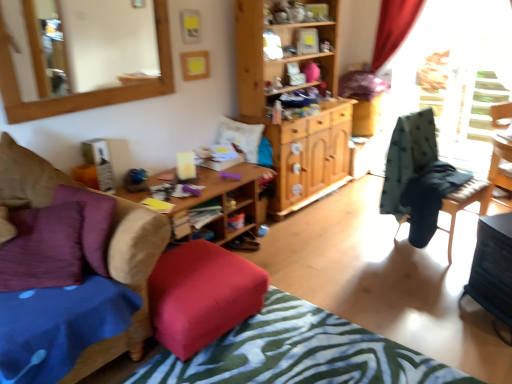
Describe the element at coordinates (493, 269) in the screenshot. I see `black glossy table at lower right` at that location.

In order to face wooden chair at right, the second chair when ordered from front to back, should I rotate leftwards or rightwards?

It's best to rotate right around 23.184 degrees.

The height and width of the screenshot is (384, 512). Describe the element at coordinates (128, 282) in the screenshot. I see `velvet cushion at lower left, the second chair when ordered from right to left` at that location.

Image resolution: width=512 pixels, height=384 pixels. Find the location of `velvet cushion at lower left, which is counted as the second chair, starting from the back`. velvet cushion at lower left, which is counted as the second chair, starting from the back is located at coordinates (128, 282).

The height and width of the screenshot is (384, 512). Describe the element at coordinates (298, 353) in the screenshot. I see `textured green and white bedspread at lower center` at that location.

The width and height of the screenshot is (512, 384). Describe the element at coordinates (241, 137) in the screenshot. I see `white soft pillow at center, placed as the 1th pillow when sorted from back to front` at that location.

Find the location of `wooden-framed mirror at upper left`. wooden-framed mirror at upper left is located at coordinates (83, 93).

Which of these two, velvet cushion at lower left, the second chair when ordered from right to left, or textured green and white bedspread at lower center, is thinner?

velvet cushion at lower left, the second chair when ordered from right to left, is thinner.

Is point (109, 250) farther from viewer compared to point (277, 323)?

No.

Is velvet cushion at lower left, which is the 1th chair from left to right, facing towards textured green and white bedspread at lower center?

Result: Yes, velvet cushion at lower left, which is the 1th chair from left to right, is oriented towards textured green and white bedspread at lower center.

There is a textured green and white bedspread at lower center. Where is `the 1st chair above it (from a real-world perspective)`? the 1st chair above it (from a real-world perspective) is located at coordinates (128, 282).

From a real-world perspective, is wooden cabinet at center physically located above or below white soft pillow at center, placed as the 1th pillow when sorted from back to front?

wooden cabinet at center is situated higher than white soft pillow at center, placed as the 1th pillow when sorted from back to front, in the real world.

Are wooden cabinet at center and white soft pillow at center, the 1th pillow from the right, beside each other?

No, wooden cabinet at center is not in contact with white soft pillow at center, the 1th pillow from the right.

In order to click on cabinetry in front of the white soft pillow at center, placed as the 1th pillow when sorted from back to front in this screenshot , I will do `click(291, 120)`.

Who is bigger, velvet red stool at center or black glossy table at lower right?

Bigger between the two is velvet red stool at center.

Is velvet red stool at center completely or partially outside of black glossy table at lower right?

That's correct, velvet red stool at center is outside of black glossy table at lower right.

Does green fabric chair at right turn towards black glossy table at lower right?

Yes, green fabric chair at right is facing black glossy table at lower right.

From the image's perspective, between green fabric chair at right and black glossy table at lower right, which one is located above?

green fabric chair at right is shown above in the image.

Is green fabric chair at right far away from black glossy table at lower right?

Yes, green fabric chair at right and black glossy table at lower right are quite far apart.

From a real-world perspective, is velvet red stool at center on green fabric chair at right?

No, from a real-world perspective, velvet red stool at center is not above green fabric chair at right.

Is velvet red stool at center positioned far away from green fabric chair at right?

Yes, velvet red stool at center and green fabric chair at right are quite far apart.

Between velvet red stool at center and green fabric chair at right, which one has smaller size?

velvet red stool at center is smaller.

Considering the positions of objects velvet red stool at center and green fabric chair at right in the image provided, who is in front, velvet red stool at center or green fabric chair at right?

Positioned in front is velvet red stool at center.

Is the surface of velvet red stool at center in direct contact with textured green and white bedspread at lower center?

No, velvet red stool at center is not next to textured green and white bedspread at lower center.

From the image's perspective, does velvet red stool at center appear higher than textured green and white bedspread at lower center?

Correct, velvet red stool at center appears higher than textured green and white bedspread at lower center in the image.

What's the angular difference between velvet red stool at center and textured green and white bedspread at lower center's facing directions?

The angular difference between velvet red stool at center and textured green and white bedspread at lower center is 3.98 degrees.

Which is more to the left, velvet red stool at center or textured green and white bedspread at lower center?

Positioned to the left is velvet red stool at center.

From the image's perspective, is green fabric chair at right above wooden desk at center?

Correct, green fabric chair at right appears higher than wooden desk at center in the image.

Looking at their sizes, would you say green fabric chair at right is wider or thinner than wooden desk at center?

green fabric chair at right is thinner than wooden desk at center.

Is green fabric chair at right placed right next to wooden desk at center?

No, green fabric chair at right is not next to wooden desk at center.

Would you say green fabric chair at right is outside wooden desk at center?

green fabric chair at right is positioned outside wooden desk at center.

Find the location of a particular element. chair that is the 1st object located behind the textured green and white bedspread at lower center is located at coordinates (128, 282).

Locate an element on the screen. This screenshot has height=384, width=512. cabinetry above the white soft pillow at center, the second pillow in the left-to-right sequence (from a real-world perspective) is located at coordinates (291, 120).

Considering their positions, is white soft pillow at center, the 1th pillow from the right, positioned further to textured green and white bedspread at lower center than purple velvet pillow at left, positioned as the 2th pillow in back-to-front order?

white soft pillow at center, the 1th pillow from the right, lies further to textured green and white bedspread at lower center than the other object.

Which object lies further to the anchor point wooden-framed mirror at upper left, velvet red stool at center or purple velvet pillow at left, which is the first pillow from left to right?

Based on the image, velvet red stool at center appears to be further to wooden-framed mirror at upper left.

Considering their positions, is textured green and white bedspread at lower center positioned closer to wooden desk at center than white soft pillow at center, the 1th pillow from the right?

Based on the image, white soft pillow at center, the 1th pillow from the right, appears to be nearer to wooden desk at center.

When comparing their distances from wooden cabinet at center, does black glossy table at lower right or textured green and white bedspread at lower center seem further?

Among the two, black glossy table at lower right is located further to wooden cabinet at center.

Estimate the real-world distances between objects in this image. Which object is further from white soft pillow at center, the 1th pillow from the right, wooden-framed mirror at upper left or wooden chair at right, placed as the 1th chair when sorted from right to left?

wooden chair at right, placed as the 1th chair when sorted from right to left, is further to white soft pillow at center, the 1th pillow from the right.

From the image, which object appears to be farther from wooden chair at right, acting as the 2th chair starting from the left, wooden-framed mirror at upper left or white soft pillow at center, the second pillow in the left-to-right sequence?

Among the two, wooden-framed mirror at upper left is located further to wooden chair at right, acting as the 2th chair starting from the left.

From the picture: Looking at the image, which one is located further to purple velvet pillow at left, which is the second pillow in right-to-left order, velvet cushion at lower left, the second chair when ordered from right to left, or wooden-framed mirror at upper left?

Based on the image, velvet cushion at lower left, the second chair when ordered from right to left, appears to be further to purple velvet pillow at left, which is the second pillow in right-to-left order.

Which object lies nearer to the anchor point wooden cabinet at center, wooden desk at center or wooden-framed mirror at upper left?

The object closer to wooden cabinet at center is wooden desk at center.

I want to click on cabinetry between wooden-framed mirror at upper left and velvet red stool at center in the up-down direction, so click(x=291, y=120).

Identify the location of mirror between purple velvet pillow at left, which is the first pillow from left to right, and white soft pillow at center, placed as the 1th pillow when sorted from back to front, in the front-back direction. (83, 93).

You are a GUI agent. You are given a task and a screenshot of the screen. Output one action in this format:
    pyautogui.click(x=<x>, y=<y>)
    Task: Click on the stool between wooden-framed mirror at upper left and green fabric chair at right from left to right
    Image resolution: width=512 pixels, height=384 pixels.
    Given the screenshot: What is the action you would take?
    pyautogui.click(x=202, y=295)

The image size is (512, 384). In order to click on desk situated between purple velvet pillow at left, which is the second pillow in right-to-left order, and textured green and white bedspread at lower center from left to right in this screenshot , I will do `click(225, 201)`.